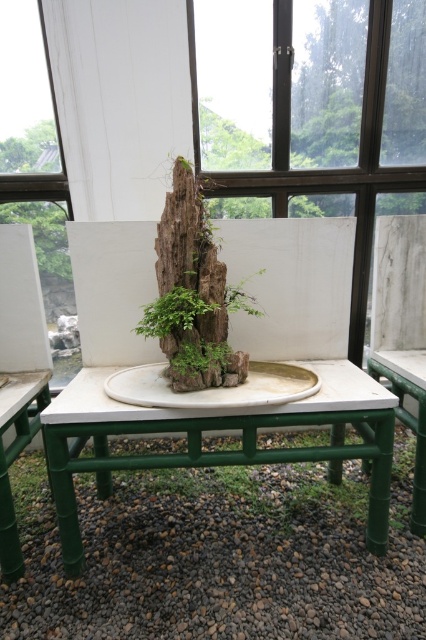
Question: Does green bamboo chair at left appear on the right side of green bamboo table at center?

Choices:
 (A) yes
 (B) no

Answer: (B)

Question: Which of the following is the closest to the observer?

Choices:
 (A) (x=241, y=19)
 (B) (x=408, y=385)

Answer: (B)

Question: Does green bamboo chair at left appear on the right side of green bamboo table at center?

Choices:
 (A) yes
 (B) no

Answer: (B)

Question: Which of the following is the closest to the observer?

Choices:
 (A) (377, 458)
 (B) (48, 376)
 (C) (276, 77)

Answer: (A)

Question: Which object appears farthest from the camera in this image?

Choices:
 (A) white matte table at center
 (B) green bamboo chair at left
 (C) green bamboo table at center
 (D) dark brown wood at upper center

Answer: (D)

Question: Is white matte table at center below green bamboo table at center?

Choices:
 (A) no
 (B) yes

Answer: (B)